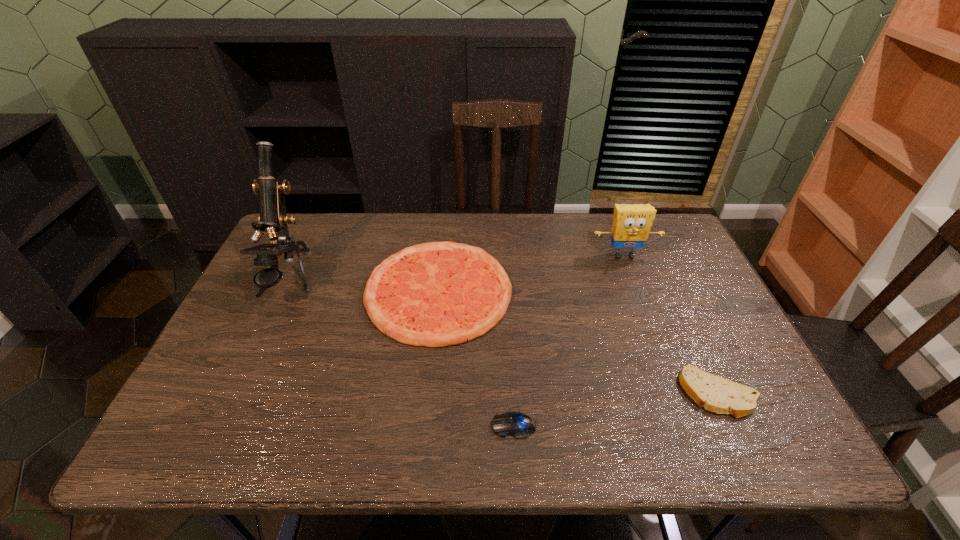
I want to click on free region that satisfies the following two spatial constraints: 1. on the face of the sponge; 2. on the left side of the pita bread, so click(x=677, y=393).

Locate an element on the screen. The height and width of the screenshot is (540, 960). free spot that satisfies the following two spatial constraints: 1. on the face of the sponge; 2. on the button side of the computer mouse is located at coordinates (689, 426).

Identify the location of vacant area that satisfies the following two spatial constraints: 1. through the eyepiece of the microscope; 2. on the right side of the pita bread. This screenshot has width=960, height=540. (235, 393).

I want to click on vacant space that satisfies the following two spatial constraints: 1. on the face of the fourth shortest object; 2. on the button side of the computer mouse, so click(689, 426).

Identify the location of free spot that satisfies the following two spatial constraints: 1. through the eyepiece of the pita bread; 2. on the right side of the leftmost object. This screenshot has width=960, height=540. (235, 393).